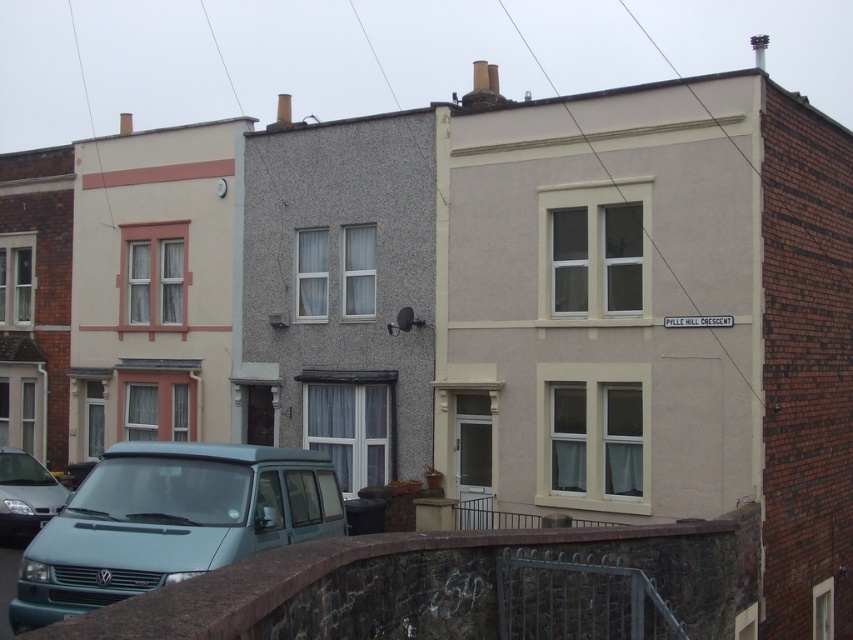
Which is above, teal matte van at center or matte silver van at lower left?

teal matte van at center is above.

You are a GUI agent. You are given a task and a screenshot of the screen. Output one action in this format:
    pyautogui.click(x=<x>, y=<y>)
    Task: Click on the teal matte van at center
    
    Given the screenshot: What is the action you would take?
    pyautogui.click(x=170, y=522)

Between point (109, 465) and point (38, 499), which one is positioned behind?

The point (38, 499) is behind.

The image size is (853, 640). I want to click on teal matte van at center, so click(170, 522).